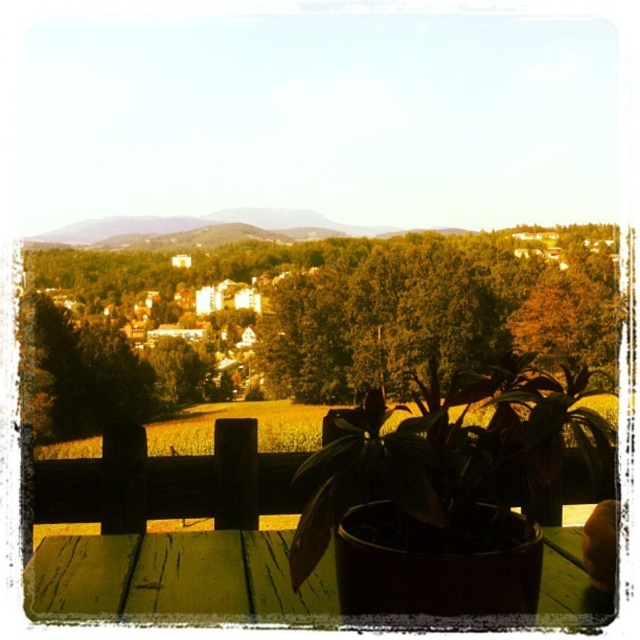
Can you confirm if green matte plant at center is positioned to the left of green wood picnic table at center?

Incorrect, green matte plant at center is not on the left side of green wood picnic table at center.

Does green matte plant at center come behind green wood picnic table at center?

No, it is in front of green wood picnic table at center.

Where is `green matte plant at center`? green matte plant at center is located at coordinates (445, 492).

Locate an element on the screen. Image resolution: width=640 pixels, height=640 pixels. green matte plant at center is located at coordinates (445, 492).